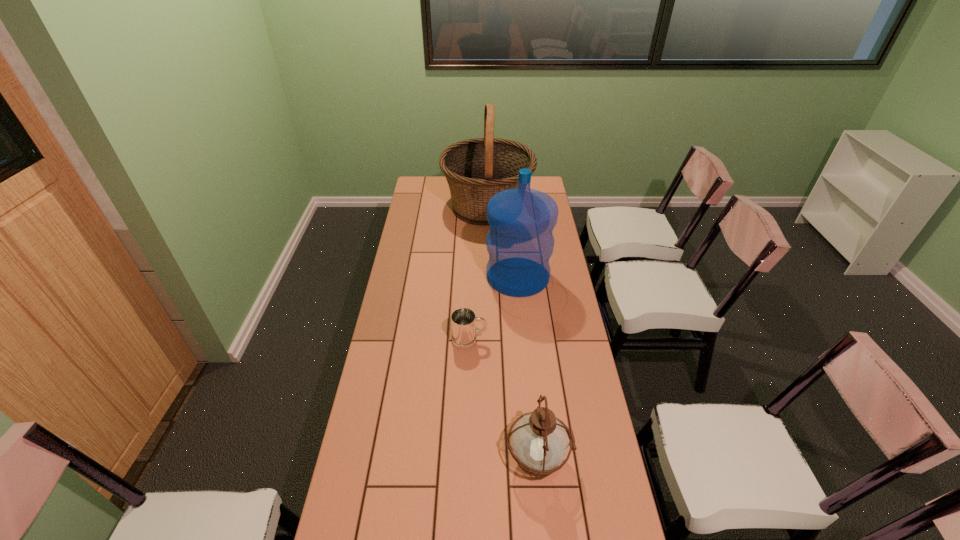
Where is `empty space that is in between the second farthest object and the mug`? This screenshot has height=540, width=960. empty space that is in between the second farthest object and the mug is located at coordinates (493, 308).

At what (x,y) coordinates should I click in order to perform the action: click on free point between the nearest object and the shortest object. Please return your answer as a coordinate pair (x, y). This screenshot has height=540, width=960. Looking at the image, I should click on (504, 399).

You are a GUI agent. You are given a task and a screenshot of the screen. Output one action in this format:
    pyautogui.click(x=<x>, y=<y>)
    Task: Click on the free area in between the second shortest object and the second farthest object
    
    Given the screenshot: What is the action you would take?
    pyautogui.click(x=528, y=367)

You are a GUI agent. You are given a task and a screenshot of the screen. Output one action in this format:
    pyautogui.click(x=<x>, y=<y>)
    Task: Click on the object that is the third closest to the water jug
    
    Given the screenshot: What is the action you would take?
    pyautogui.click(x=539, y=441)

The width and height of the screenshot is (960, 540). I want to click on object that is the second closest to the nearest object, so click(520, 242).

Identify the location of free location that satisfies the following two spatial constraints: 1. on the front side of the water jug; 2. on the side of the mug with the handle. Image resolution: width=960 pixels, height=540 pixels. (524, 340).